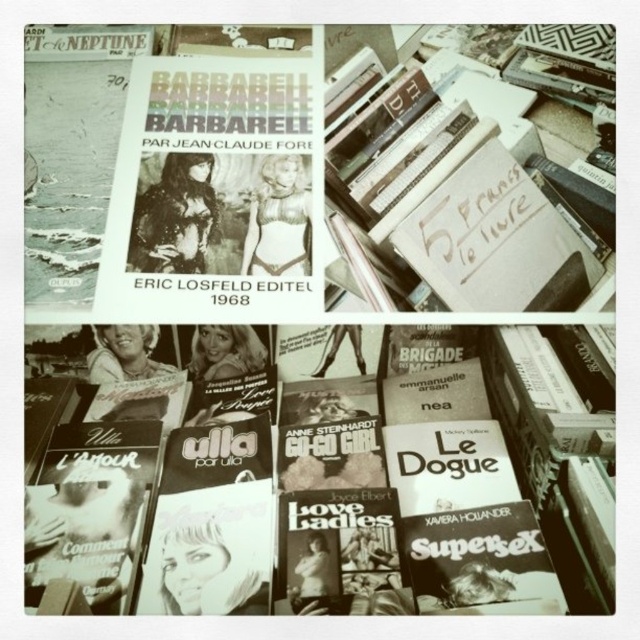
You are a customer at a flea market and see the soft matte book at center and the white paper sign at center. Which item is positioned more to the left?

The soft matte book at center is positioned more to the left than the white paper sign at center.

Looking at this image, you are a collector at a vintage book fair and want to examine the soft matte book at center closely. If you extend your hand to touch it, will you be able to reach it without moving your body? Assume your arm can reach up to 24 inches.

The soft matte book at center is 21.67 inches away from the viewer. Since your arm can reach up to 24 inches, you can comfortably reach the soft matte book at center without moving your body.

You are a customer at a flea market and see the soft matte book at center and the white paper sign at center. The vendor says the sign is taller than the book. Which item should you pick up first if you want to read the text on both items without bending down?

You should pick up the soft matte book at center first because it is shorter than the white paper sign at center, so you can read its text without bending down first and then reach for the taller sign.